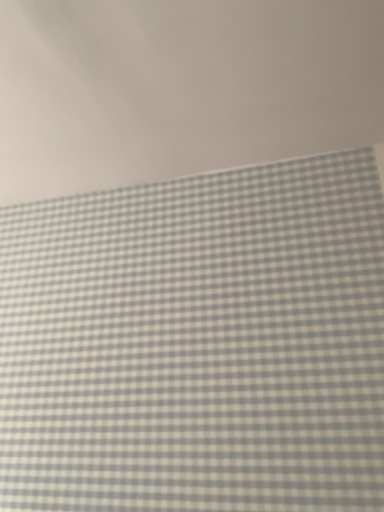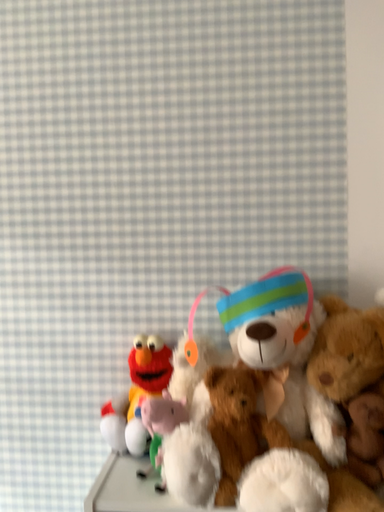
Question: Which way did the camera rotate in the video?

Choices:
 (A) rotated left
 (B) rotated right

Answer: (B)